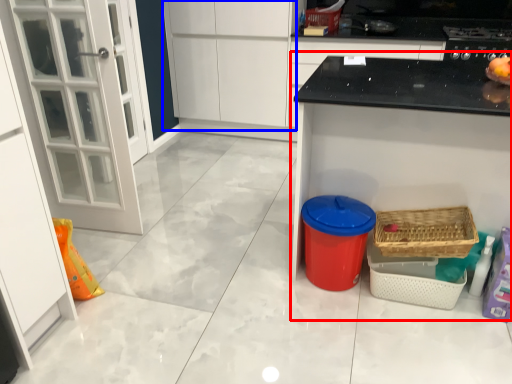
Question: Among these objects, which one is farthest to the camera, counter (highlighted by a red box) or cabinetry (highlighted by a blue box)?

Choices:
 (A) counter
 (B) cabinetry

Answer: (B)